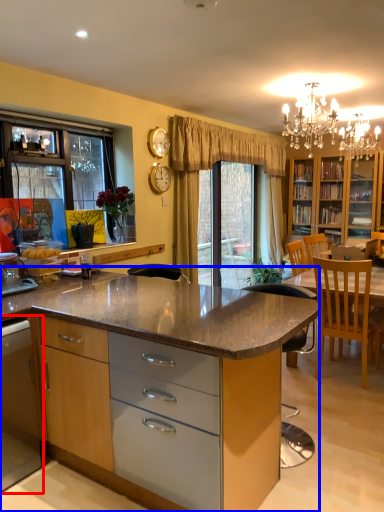
Question: Which object appears closest to the camera in this image, cabinetry (highlighted by a red box) or cabinetry (highlighted by a blue box)?

Choices:
 (A) cabinetry
 (B) cabinetry

Answer: (B)